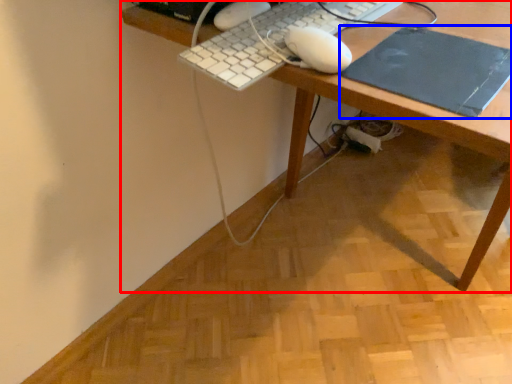
Question: Which object appears closest to the camera in this image, desk (highlighted by a red box) or mousepad (highlighted by a blue box)?

Choices:
 (A) desk
 (B) mousepad

Answer: (A)